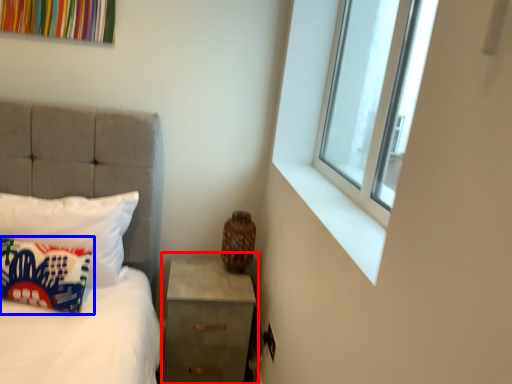
Question: Which object is further to the camera taking this photo, nightstand (highlighted by a red box) or pillow (highlighted by a blue box)?

Choices:
 (A) nightstand
 (B) pillow

Answer: (A)